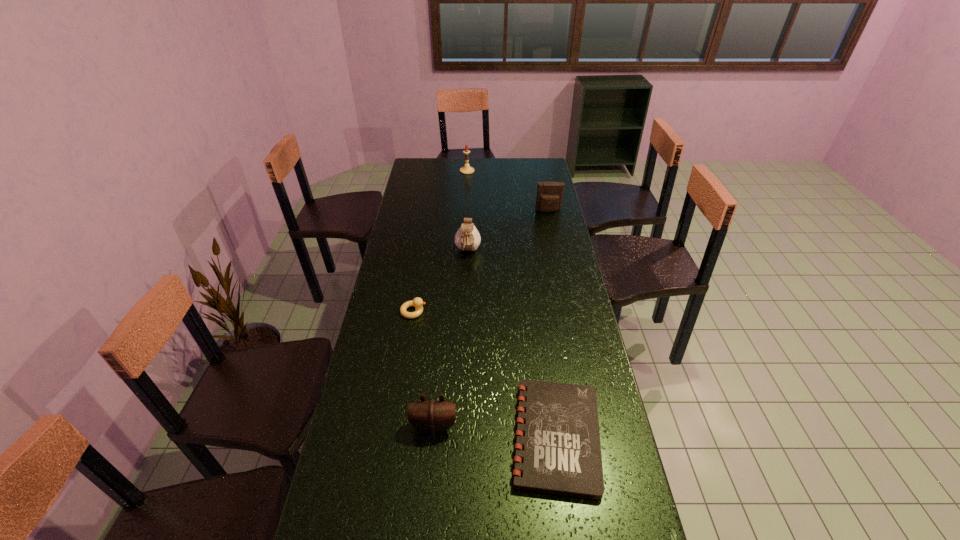
In order to click on free space between the fifth tallest object and the farthest object in this screenshot , I will do `click(441, 241)`.

I want to click on vacant space in between the notebook and the second shortest object, so click(485, 374).

This screenshot has height=540, width=960. I want to click on free point between the notebook and the farthest object, so click(x=512, y=303).

You are a GUI agent. You are given a task and a screenshot of the screen. Output one action in this format:
    pyautogui.click(x=<x>, y=<y>)
    Task: Click on the free area in between the fourth nearest object and the nearest pouch
    The width and height of the screenshot is (960, 540).
    Given the screenshot: What is the action you would take?
    pyautogui.click(x=451, y=339)

At what (x,y) coordinates should I click in order to perform the action: click on object that is the fourth closest to the fourth nearest object. Please return your answer as a coordinate pair (x, y). Looking at the image, I should click on (562, 455).

Locate which object ranks third in proximity to the second nearest pouch. Please provide its 2D coordinates. Your answer should be formatted as a tuple, i.e. [(x, y)], where the tuple contains the x and y coordinates of a point satisfying the conditions above.

[(466, 169)]

Where is `the closest pouch to the third farthest object`? This screenshot has height=540, width=960. the closest pouch to the third farthest object is located at coordinates (549, 197).

Locate which pouch ranks second in proximity to the second farthest pouch. Please provide its 2D coordinates. Your answer should be formatted as a tuple, i.e. [(x, y)], where the tuple contains the x and y coordinates of a point satisfying the conditions above.

[(432, 416)]

At what (x,y) coordinates should I click in order to perform the action: click on blank area in the image that satisfies the following two spatial constraints: 1. on the front-facing side of the notebook; 2. on the left side of the third farthest object. Please return your answer as a coordinate pair (x, y). Looking at the image, I should click on (462, 436).

Locate an element on the screen. The height and width of the screenshot is (540, 960). free location that satisfies the following two spatial constraints: 1. at the beak of the third nearest object; 2. on the right side of the shortest object is located at coordinates (394, 436).